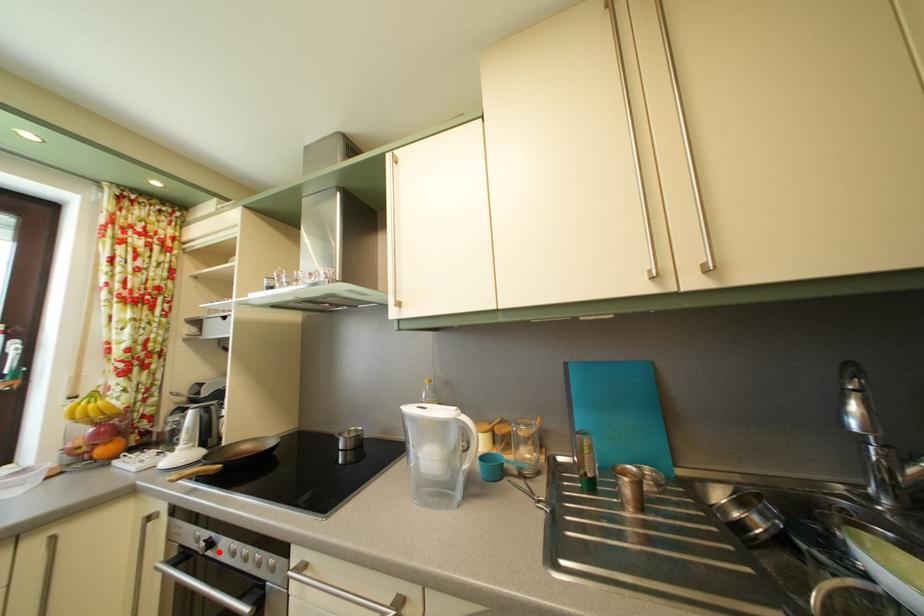
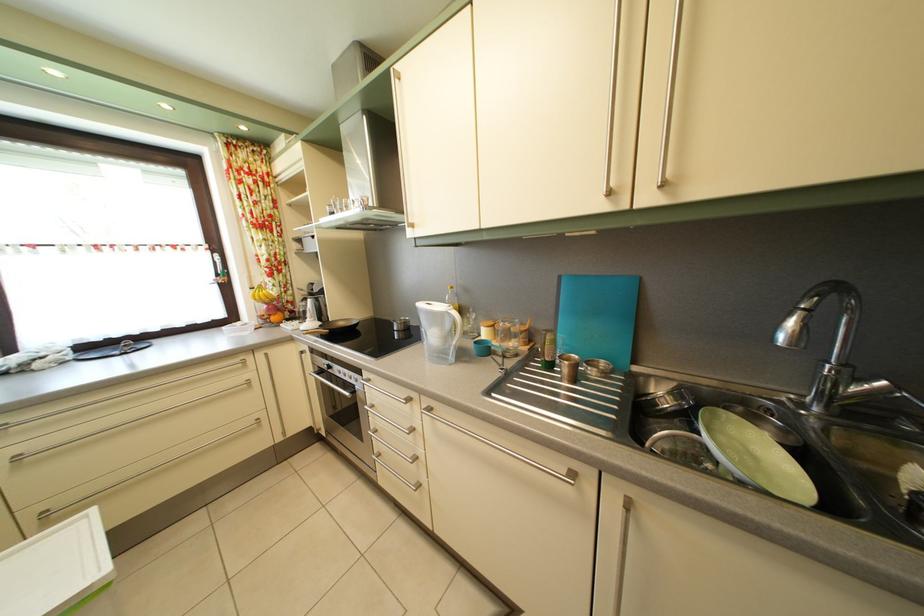
The point at the highlighted location is marked in the first image. Where is the corresponding point in the second image?

(337, 374)